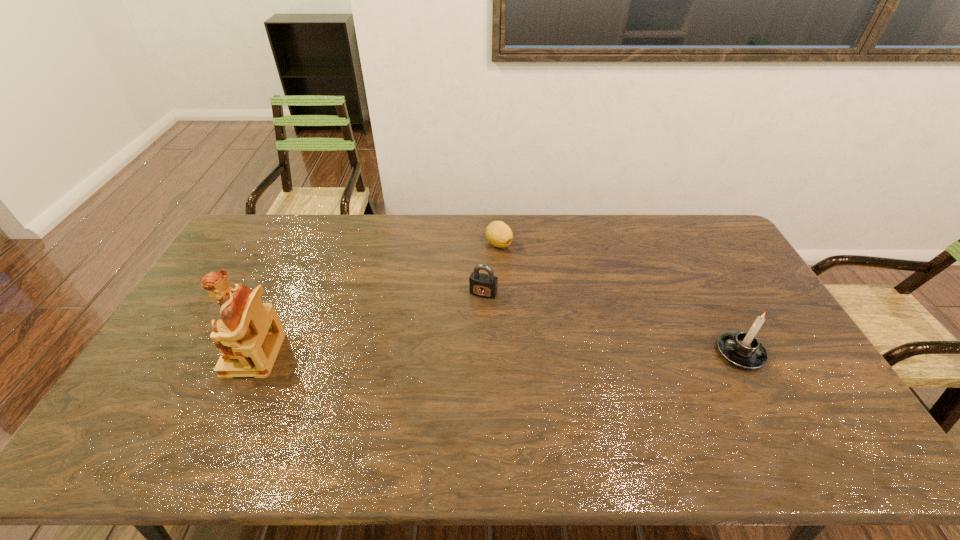
Locate an element on the screen. The height and width of the screenshot is (540, 960). vacant space on the desktop that is between the tallest object and the second tallest object and is positioned at the stem end of the lemon is located at coordinates (540, 353).

This screenshot has height=540, width=960. Identify the location of free spot on the desktop that is between the figurine and the candle holder and is positioned on the front of the second shortest object near the keyhole. coord(457,354).